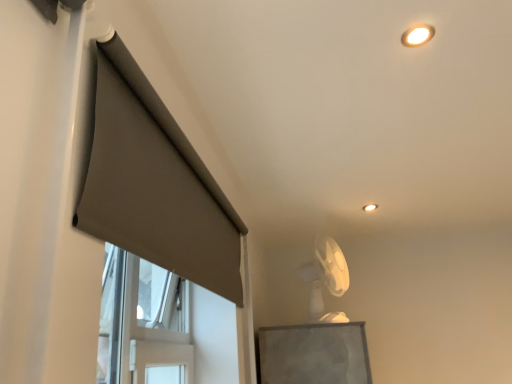
Question: From the image's perspective, would you say matte gray curtain at left is positioned over white plastic fan at upper center?

Choices:
 (A) yes
 (B) no

Answer: (A)

Question: Could white plastic fan at upper center be considered to be inside matte gray curtain at left?

Choices:
 (A) no
 (B) yes

Answer: (A)

Question: Can you confirm if matte gray curtain at left is taller than white plastic fan at upper center?

Choices:
 (A) yes
 (B) no

Answer: (B)

Question: Is matte gray curtain at left next to white plastic fan at upper center?

Choices:
 (A) yes
 (B) no

Answer: (B)

Question: Considering the relative positions of matte gray curtain at left and white plastic fan at upper center in the image provided, is matte gray curtain at left in front of white plastic fan at upper center?

Choices:
 (A) yes
 (B) no

Answer: (A)

Question: From the image's perspective, is white plastic fan at upper center located above or below matte gray curtain at left?

Choices:
 (A) below
 (B) above

Answer: (A)

Question: Relative to matte gray curtain at left, is white plastic fan at upper center in front or behind?

Choices:
 (A) behind
 (B) front

Answer: (A)

Question: Is white plastic fan at upper center wider or thinner than matte gray curtain at left?

Choices:
 (A) wide
 (B) thin

Answer: (A)

Question: Is white plastic fan at upper center situated inside matte gray curtain at left or outside?

Choices:
 (A) outside
 (B) inside

Answer: (A)

Question: From a real-world perspective, relative to white plastic fan at upper center, is matte gray curtain at left vertically above or below?

Choices:
 (A) above
 (B) below

Answer: (A)

Question: In terms of width, does matte gray curtain at left look wider or thinner when compared to white plastic fan at upper center?

Choices:
 (A) thin
 (B) wide

Answer: (A)

Question: From the image's perspective, is matte gray curtain at left positioned above or below white plastic fan at upper center?

Choices:
 (A) above
 (B) below

Answer: (A)

Question: Considering the positions of point (89, 122) and point (306, 276), is point (89, 122) closer or farther from the camera than point (306, 276)?

Choices:
 (A) farther
 (B) closer

Answer: (B)

Question: Visually, is white plastic fan at upper center positioned to the left or to the right of matte white ceiling light at upper center?

Choices:
 (A) right
 (B) left

Answer: (B)

Question: From a real-world perspective, relative to matte white ceiling light at upper center, is white plastic fan at upper center vertically above or below?

Choices:
 (A) above
 (B) below

Answer: (B)